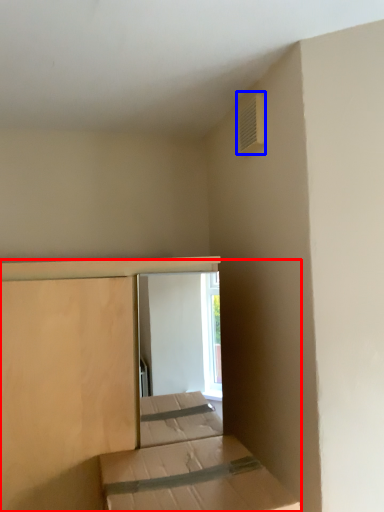
Question: Among these objects, which one is nearest to the camera, bed (highlighted by a red box) or air conditioning (highlighted by a blue box)?

Choices:
 (A) bed
 (B) air conditioning

Answer: (A)